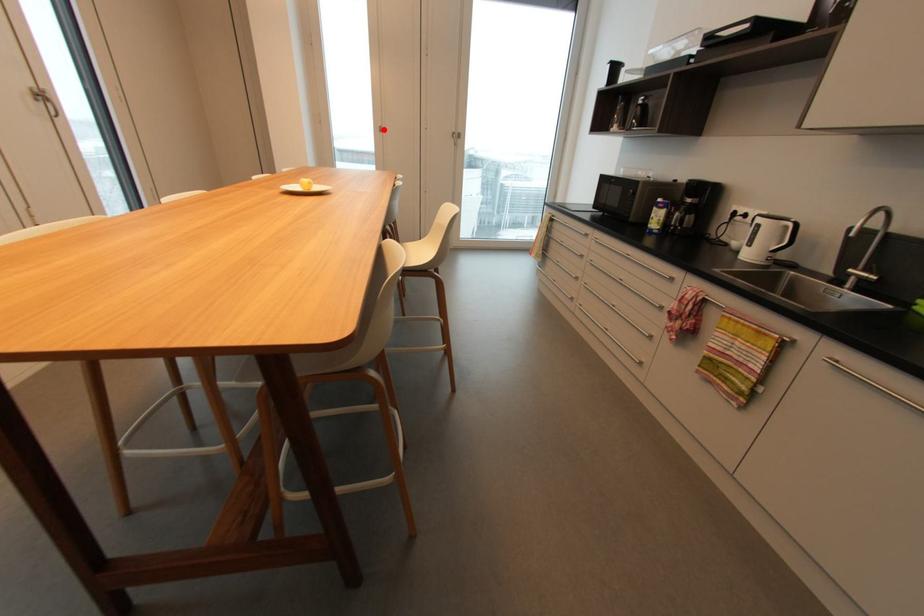
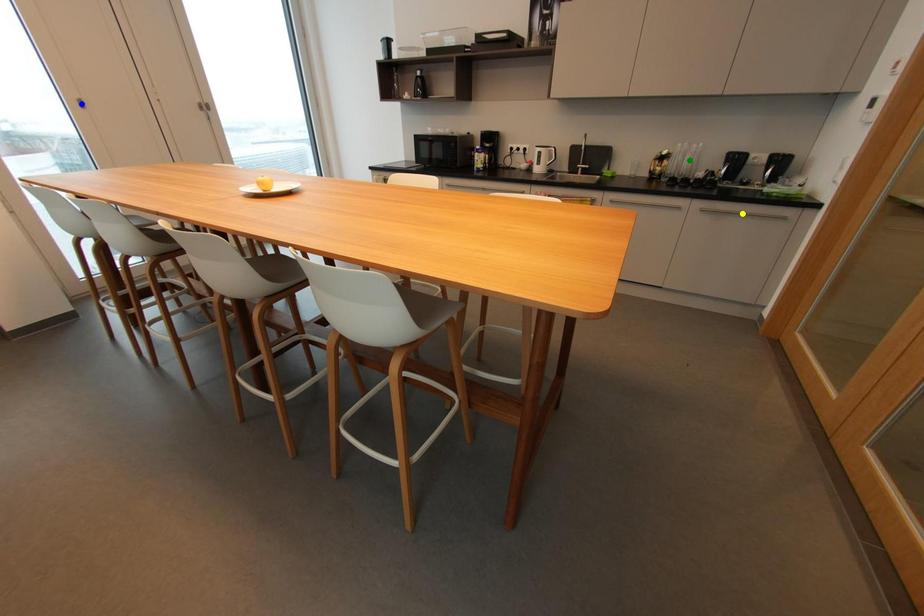
Question: I am providing you with two images of the same scene from different viewpoints. A red point is marked on the first image. You are given multiple points on the second image. In image 2, which mark is for the same physical point as the one in image 1?

Choices:
 (A) green point
 (B) blue point
 (C) yellow point

Answer: (B)